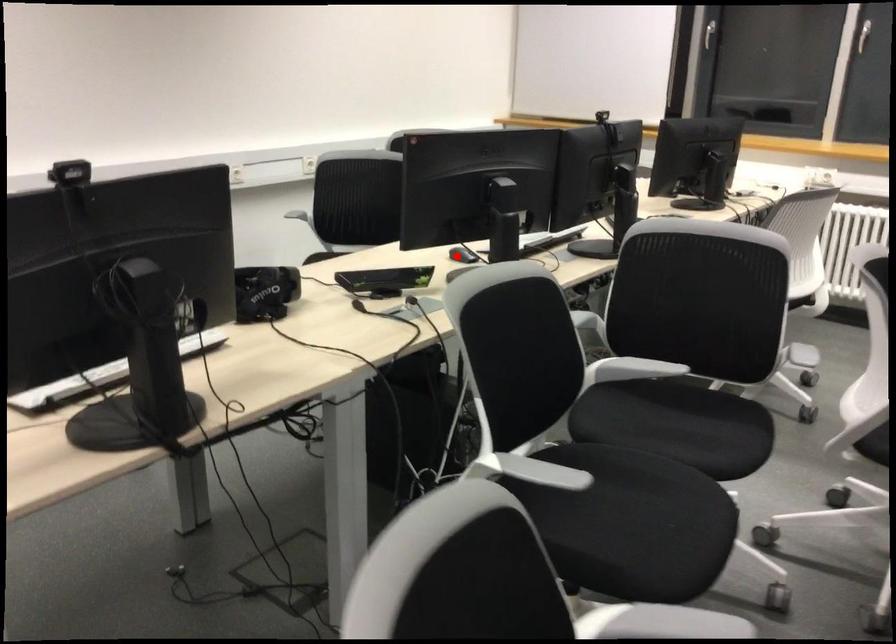
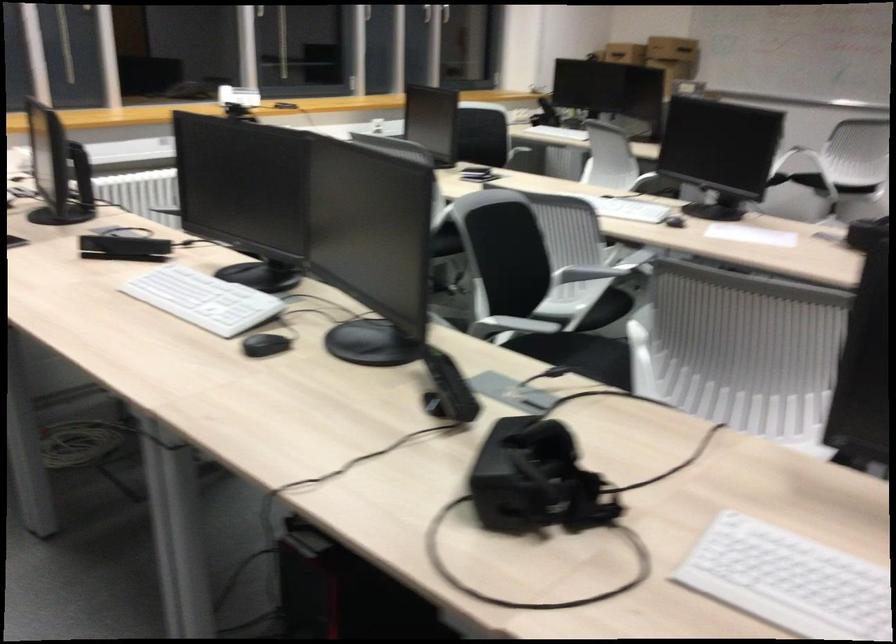
Question: I am providing you with two images of the same scene from different viewpoints. Given a red point in image1, look at the same physical point in image2. Is it:

Choices:
 (A) Closer to the viewpoint
 (B) Farther from the viewpoint

Answer: (A)